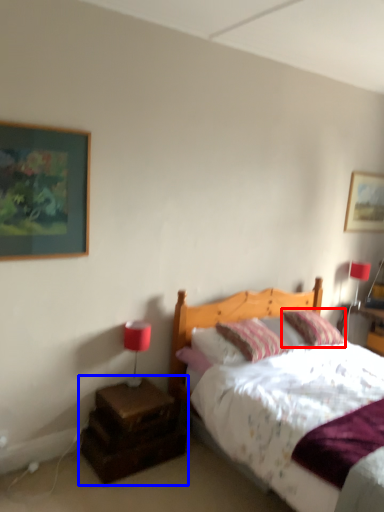
Question: Among these objects, which one is farthest to the camera, pillow (highlighted by a red box) or nightstand (highlighted by a blue box)?

Choices:
 (A) pillow
 (B) nightstand

Answer: (A)